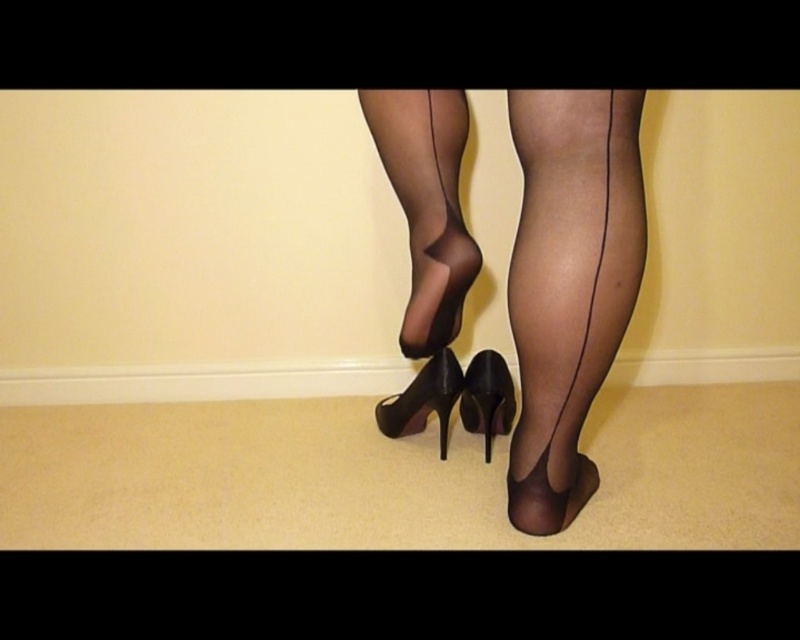
Does point (616, 189) lie in front of point (462, 278)?

That is True.

Does point (560, 358) lie behind point (414, 324)?

No, (560, 358) is closer to viewer.

This screenshot has height=640, width=800. Identify the location of sheer black tights at center. (570, 284).

Can you confirm if transparent nylon leg at center is positioned to the right of black leather high-heeled shoe at center?

Incorrect, transparent nylon leg at center is not on the right side of black leather high-heeled shoe at center.

Can you confirm if transparent nylon leg at center is thinner than black leather high-heeled shoe at center?

No, transparent nylon leg at center is not thinner than black leather high-heeled shoe at center.

The height and width of the screenshot is (640, 800). Identify the location of transparent nylon leg at center. (426, 243).

Is sheer black tights at center positioned behind shiny black high-heeled shoe at center?

No, sheer black tights at center is closer to the viewer.

Who is positioned more to the left, sheer black tights at center or shiny black high-heeled shoe at center?

Positioned to the left is shiny black high-heeled shoe at center.

You are a GUI agent. You are given a task and a screenshot of the screen. Output one action in this format:
    pyautogui.click(x=<x>, y=<y>)
    Task: Click on the sheer black tights at center
    
    Given the screenshot: What is the action you would take?
    pyautogui.click(x=570, y=284)